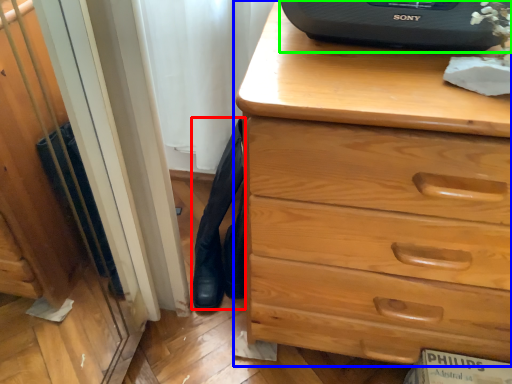
Question: Considering the real-world distances, which object is farthest from tight (highlighted by a red box)? chest of drawers (highlighted by a blue box) or desktop computer (highlighted by a green box)?

Choices:
 (A) chest of drawers
 (B) desktop computer

Answer: (B)